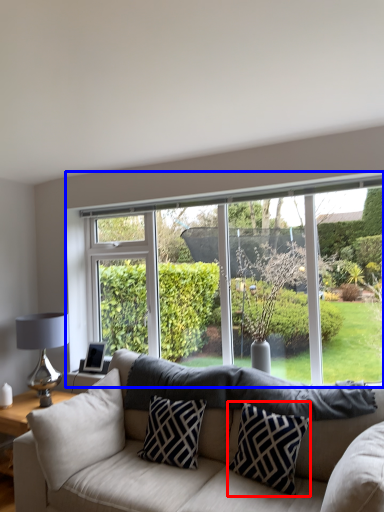
Question: Which of the following is the farthest to the observer, pillow (highlighted by a red box) or window (highlighted by a blue box)?

Choices:
 (A) pillow
 (B) window

Answer: (B)